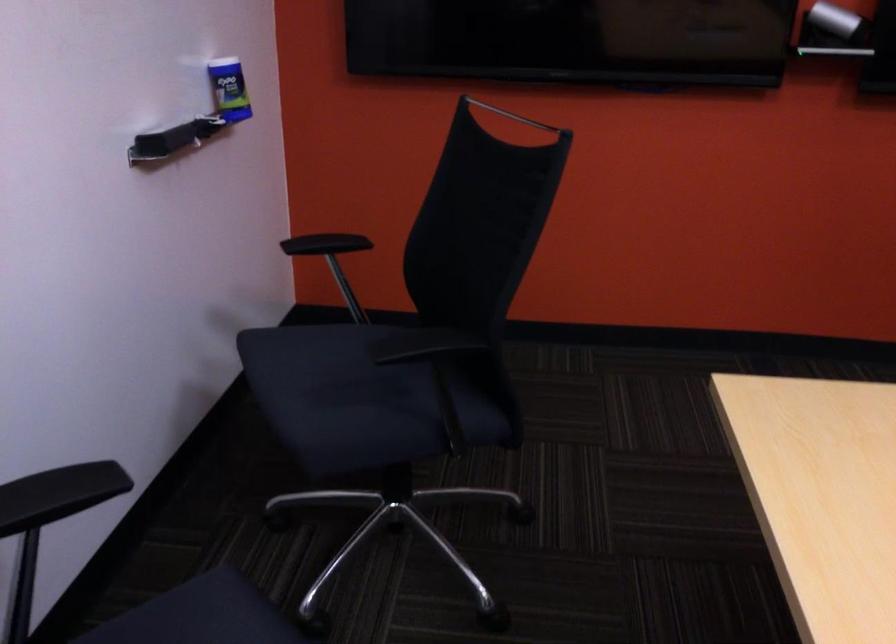
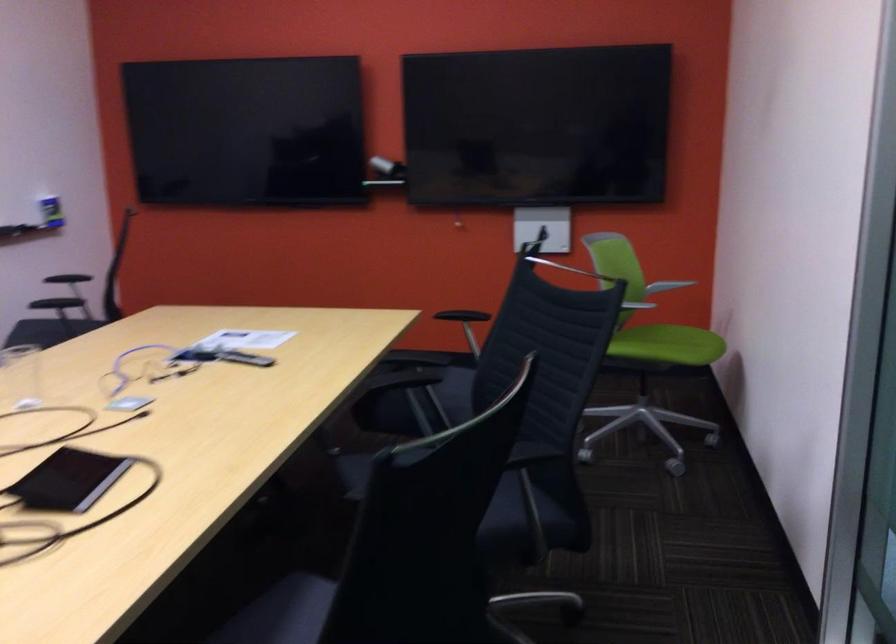
What movement of the cameraman would produce the second image?

The cameraman moved toward right, backward.